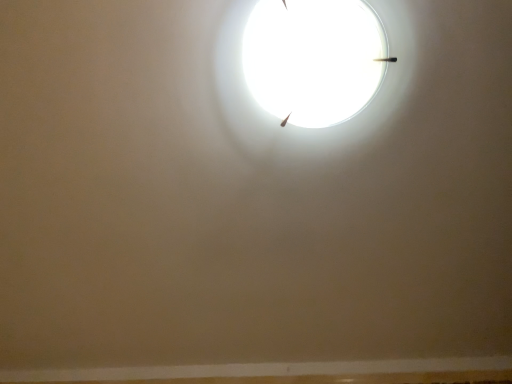
The height and width of the screenshot is (384, 512). Describe the element at coordinates (314, 59) in the screenshot. I see `white glossy lampshade at upper center` at that location.

Find the location of `white glossy lampshade at upper center`. white glossy lampshade at upper center is located at coordinates (314, 59).

What is the approximate width of white glossy lampshade at upper center?

white glossy lampshade at upper center is 9.58 inches wide.

The height and width of the screenshot is (384, 512). In order to click on white glossy lampshade at upper center in this screenshot , I will do `click(314, 59)`.